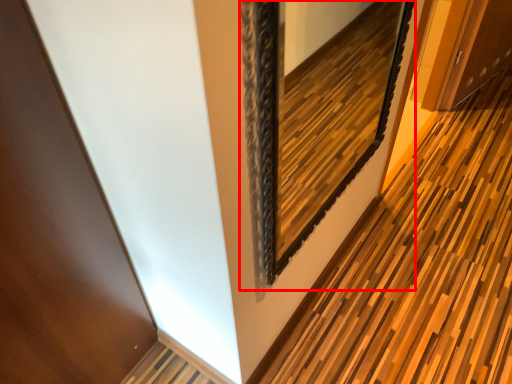
Question: Considering the relative positions of picture frame (annotated by the red box) and path in the image provided, where is picture frame (annotated by the red box) located with respect to the staircase?

Choices:
 (A) left
 (B) right

Answer: (A)